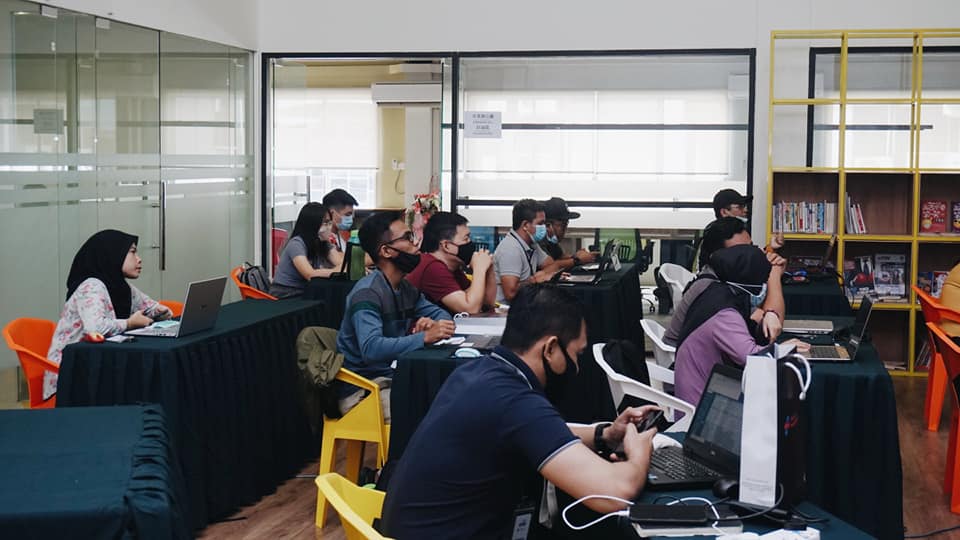
I want to click on computer, so click(727, 420), click(729, 387), click(201, 300), click(350, 273), click(574, 276), click(574, 288), click(864, 320), click(803, 323).